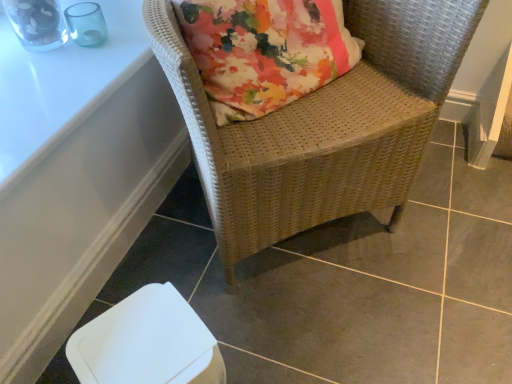
You are a GUI agent. You are given a task and a screenshot of the screen. Output one action in this format:
    pyautogui.click(x=<x>, y=<y>)
    Task: Click on the vacant space to the right of white plastic table at lower left, the 2th table when ordered from top to bottom
    The width and height of the screenshot is (512, 384).
    Given the screenshot: What is the action you would take?
    pyautogui.click(x=232, y=283)